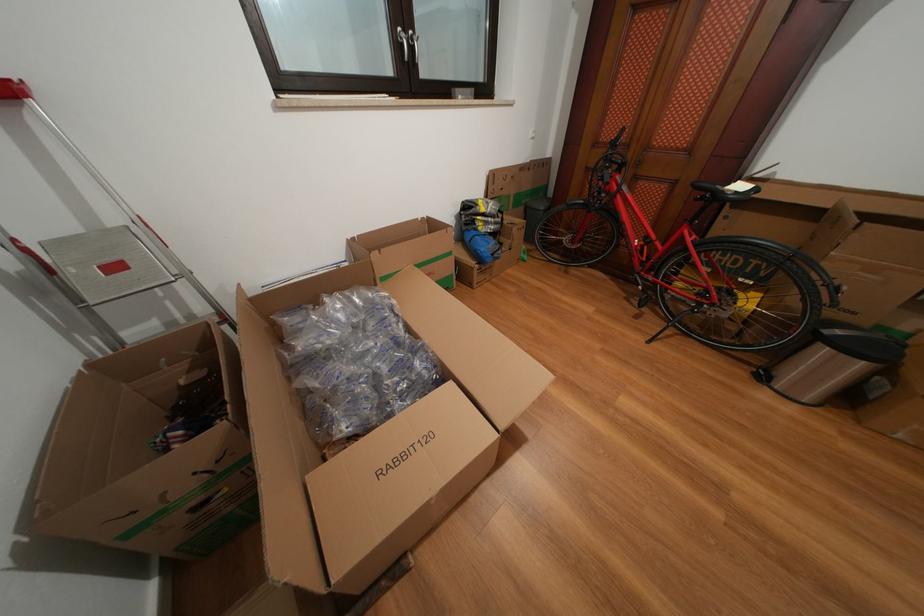
Describe the element at coordinates (105, 264) in the screenshot. I see `a metal ladder step` at that location.